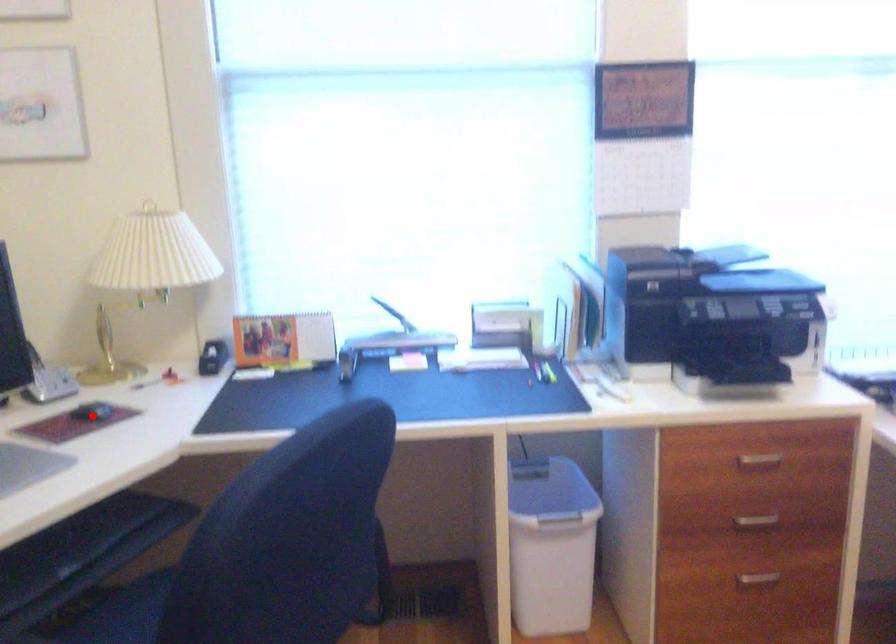
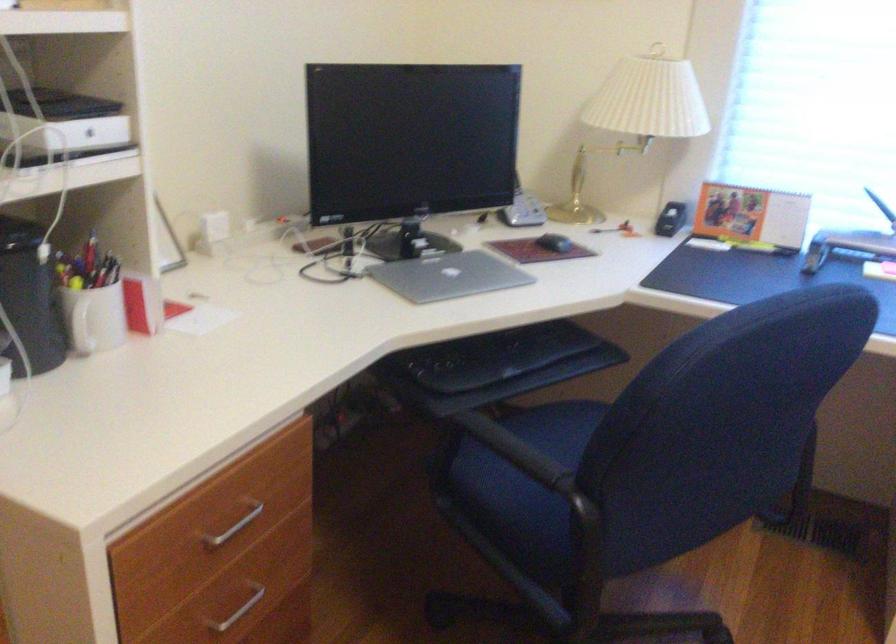
Find the pixel in the second image that matches the highlighted location in the first image.

(554, 243)